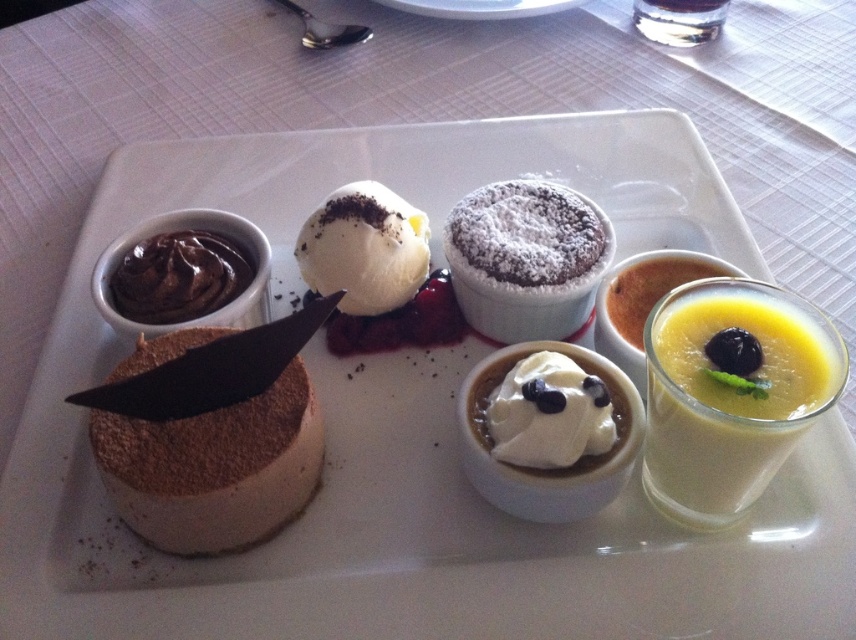
You are a dessert lover who wants to know which dessert is larger between the white creamy ice cream at center and the clear glass at upper center. Based on the scene description, which one is bigger?

The white creamy ice cream at center is bigger than the clear glass at upper center according to the description.

You are a dessert lover who wants to take a spoonful of the white creamy ice cream at center. However, there is a clear glass at upper center nearby. Based on the scene description, can you tell me which direction you should move your spoon to avoid hitting the glass?

The white creamy ice cream at center is positioned on the left side of the clear glass at upper center, so you should move your spoon to the left to avoid hitting the glass.